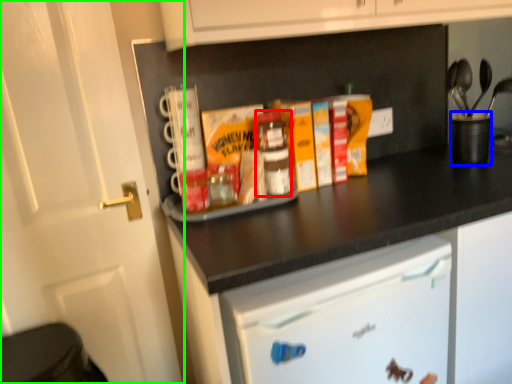
Question: Which object is positioned farthest from bottle (highlighted by a red box)? Select from appliance (highlighted by a blue box) and door (highlighted by a green box).

Choices:
 (A) appliance
 (B) door

Answer: (A)